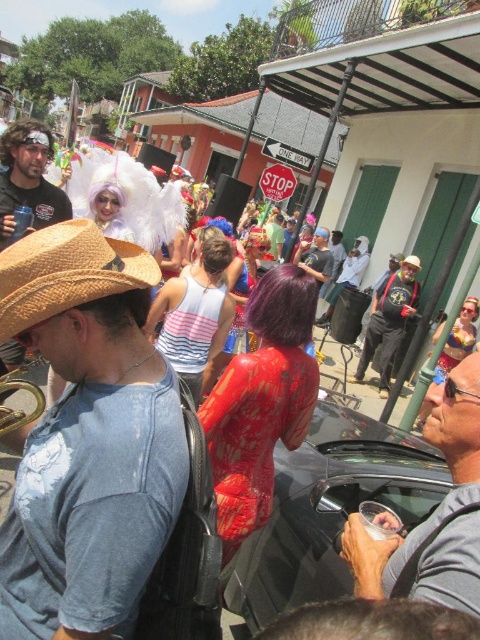
In the scene shown: You are standing in the middle of the street looking at the festive scene. There are two points marked in the image. The first point is at coordinates point (x=104, y=227) and the second point is at point (x=269, y=225). Which point is closer to you?

Point (x=104, y=227) is closer to the viewer than point (x=269, y=225).

You are a photographer trying to capture a closeup of the matte black sunglasses at center. Given that your camera has a focal length of 50mm and you are currently positioned at point 0.5, 0.5, can you determine if you need to adjust your position to get the sunglasses into the frame?

The matte black sunglasses at center is located at point (445,496), so you need to move closer to that coordinate to ensure it is centered in your frame.

You are a photographer standing at the center of the street. You want to take a photo that includes both the straw hat at center and the matte green shirt at center. The camera you are using has a maximum focus range of 10 meters. Can you capture both subjects in focus without moving your position?

The straw hat at center is 11.33 meters away from matte green shirt at center. Since the maximum focus range of the camera is 10 meters, the distance between them exceeds this limit. Therefore, you cannot capture both subjects in focus without moving your position.